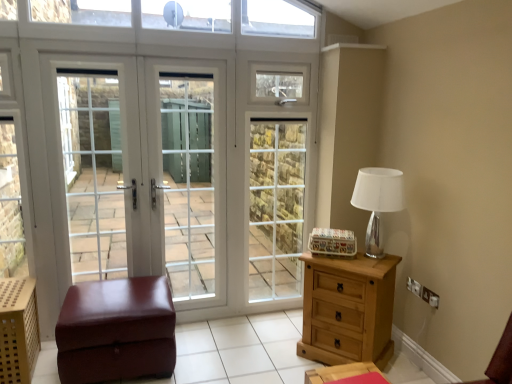
Question: In terms of width, does white glass screen door at left, the third screen door from the right, look wider or thinner when compared to white glass screen door at center, placed as the second screen door when sorted from left to right?

Choices:
 (A) thin
 (B) wide

Answer: (B)

Question: From their relative heights in the image, would you say white glass screen door at left, arranged as the first screen door when viewed from the left, is taller or shorter than white glass screen door at center, placed as the second screen door when sorted from left to right?

Choices:
 (A) tall
 (B) short

Answer: (B)

Question: Which is nearer to the white glass door at center, which appears as the 3th screen door when viewed from the left?

Choices:
 (A) wooden perforated crate at lower left
 (B) white glass screen door at left, arranged as the first screen door when viewed from the left
 (C) silver metallic table lamp at right
 (D) brown leather ottoman at lower left
 (E) light brown wooden chest of drawers at right

Answer: (E)

Question: Estimate the real-world distances between objects in this image. Which object is closer to the silver metallic table lamp at right?

Choices:
 (A) white glass door at center
 (B) wooden nightstand at lower right
 (C) white glass screen door at left, the third screen door from the right
 (D) brown leather ottoman at lower left
 (E) white glass screen door at center, placed as the second screen door when sorted from left to right

Answer: (B)